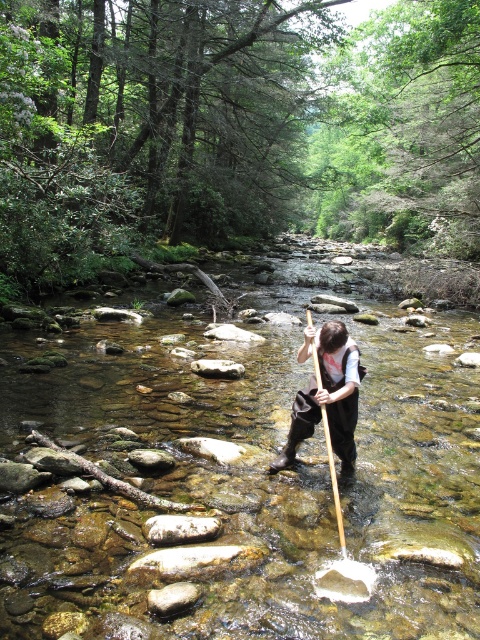
Does brown leather boots at center have a smaller size compared to wooden paddle at center?

Yes.

Is brown leather boots at center positioned at the back of wooden paddle at center?

Result: That is True.

Is point (340, 403) positioned behind point (330, 461)?

Yes, it is behind point (330, 461).

The image size is (480, 640). I want to click on brown leather boots at center, so click(x=326, y=396).

Does clear stone river at center have a lesser width compared to brown leather boots at center?

No, clear stone river at center is not thinner than brown leather boots at center.

Who is more forward, (242, 586) or (336, 384)?

Positioned in front is point (242, 586).

Who is more distant from viewer, (x=424, y=372) or (x=319, y=337)?

The point (x=424, y=372) is behind.

This screenshot has height=640, width=480. I want to click on clear stone river at center, so click(237, 476).

Does point (15, 362) come behind point (343, 540)?

Yes, it is behind point (343, 540).

Does point (247, 365) come in front of point (320, 406)?

No, (247, 365) is behind (320, 406).

Image resolution: width=480 pixels, height=640 pixels. Identify the location of clear stone river at center. (237, 476).